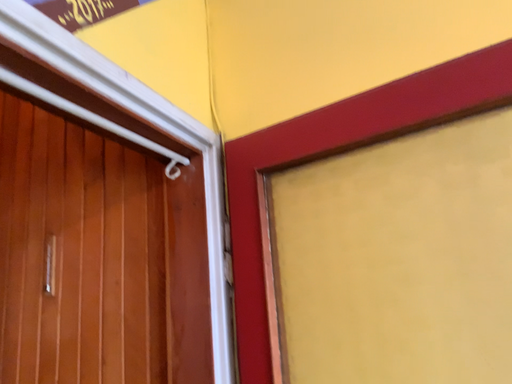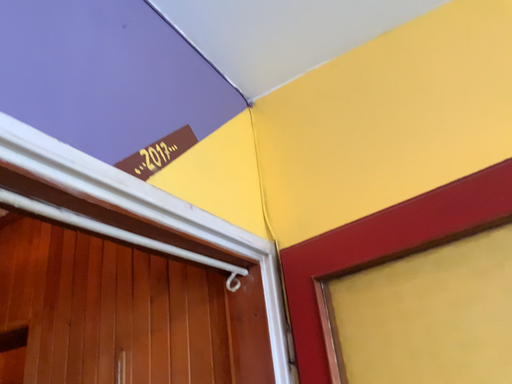
Question: Which way did the camera rotate in the video?

Choices:
 (A) rotated left
 (B) rotated right

Answer: (A)